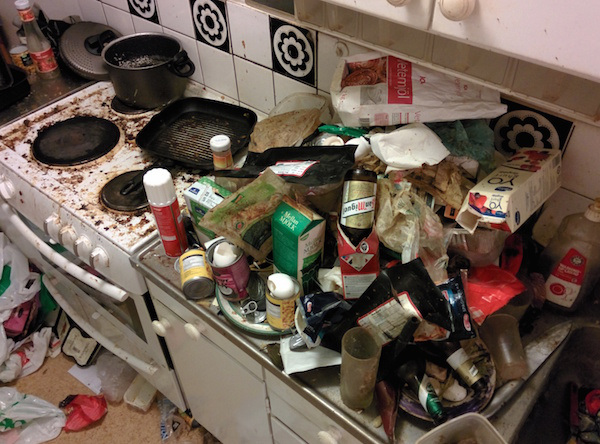
You are a GUI agent. You are given a task and a screenshot of the screen. Output one action in this format:
    pyautogui.click(x=<x>, y=<y>)
    Task: Click on the floor
    The height and width of the screenshot is (444, 600).
    Given the screenshot: What is the action you would take?
    pyautogui.click(x=120, y=414)